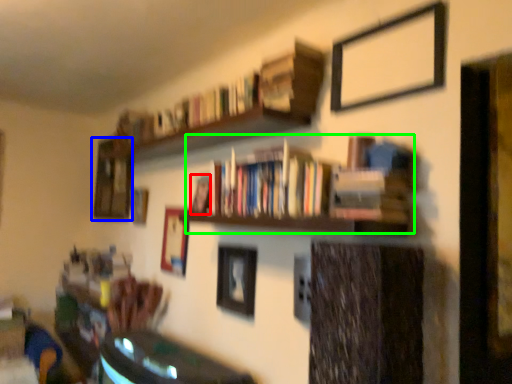
Question: Estimate the real-world distances between objects in this image. Which object is farther from book (highlighted by a red box), picture frame (highlighted by a blue box) or book (highlighted by a green box)?

Choices:
 (A) picture frame
 (B) book

Answer: (A)